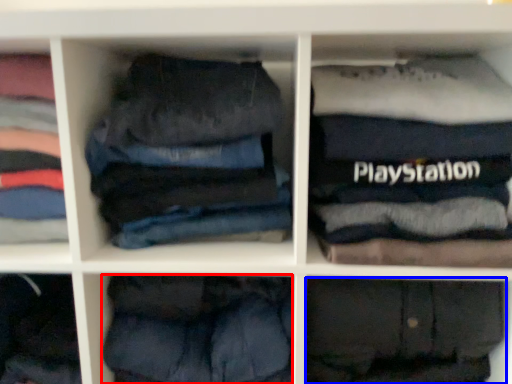
Question: Which of the following is the closest to the observer, trousers (highlighted by a red box) or trousers (highlighted by a blue box)?

Choices:
 (A) trousers
 (B) trousers

Answer: (B)